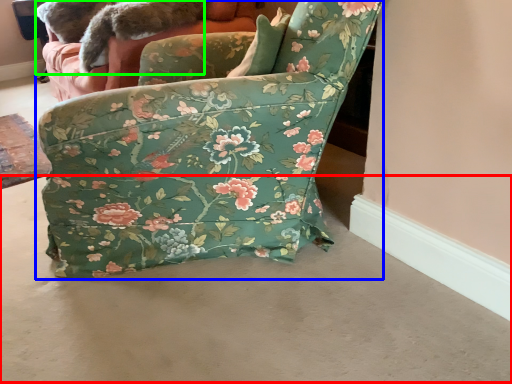
Question: Considering the real-world distances, which object is closest to concrete (highlighted by a red box)? chair (highlighted by a blue box) or animal (highlighted by a green box).

Choices:
 (A) chair
 (B) animal

Answer: (A)